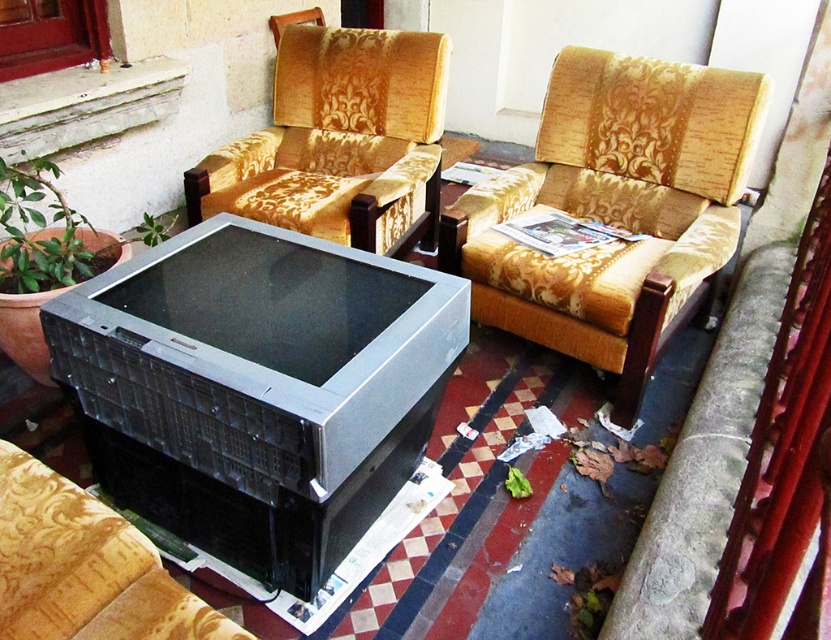
You are standing in the outdoor seating area and want to place a small potted plant between the two points labeled point (731,93) and point (38,593). Which point should the plant be closer to in order to be nearer to the camera?

The plant should be closer to point (731,93) because it is further to the camera than point (38,593).

You are standing at the origin point of the coordinate system in the image. You want to move towards the gold patterned fabric armchair at center. What direction should you move in?

Since the gold patterned fabric armchair at center is located at coordinate point 0.328 on the x axis and 0.740 on the y axis, you should move towards the right and forward to reach it.

You are a painter standing in front of the gold patterned fabric armchair at center and the gold patterned armchair at upper center. You need to paint the taller one. Which armchair should you paint?

The gold patterned fabric armchair at center is taller than the gold patterned armchair at upper center, so you should paint the gold patterned fabric armchair at center.